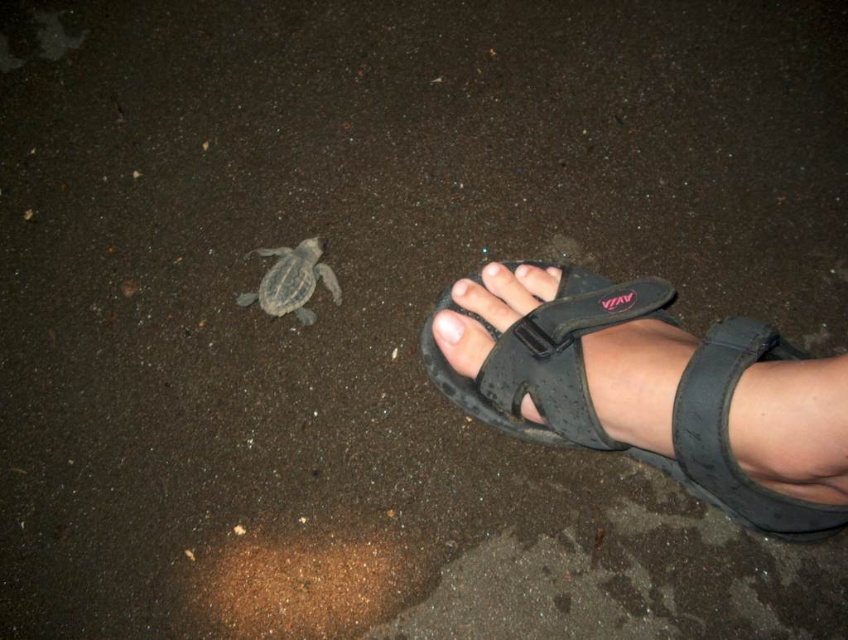
You are a small animal trying to cross a path. You see a pale skin toe at center and a matte black toe at center nearby. Which direction should you move to get away from both toes?

The pale skin toe at center and matte black toe at center are 2.82 inches apart from each other. To get away from both, move in a direction perpendicular to the line connecting them, such as diagonally away from the toes.

You are a photographer trying to capture the turtle in the scene. You notice the black synthetic sandal at lower right and the pale skin toe at center. Which object is closer to the camera?

The black synthetic sandal at lower right is closer to the camera because it is in front of the pale skin toe at center.